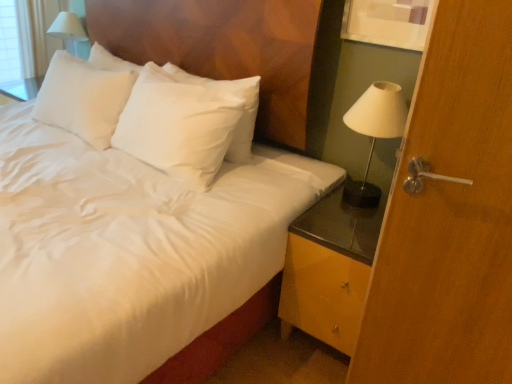
Question: Should I look upward or downward to see white glossy table lamp at upper left?

Choices:
 (A) up
 (B) down

Answer: (A)

Question: Is white glossy table lamp at upper left not within white glossy lamp at right?

Choices:
 (A) no
 (B) yes

Answer: (B)

Question: From the image's perspective, is white glossy table lamp at upper left on white glossy lamp at right?

Choices:
 (A) yes
 (B) no

Answer: (A)

Question: Is white glossy table lamp at upper left facing towards white glossy lamp at right?

Choices:
 (A) no
 (B) yes

Answer: (A)

Question: Can you confirm if white glossy table lamp at upper left is thinner than white glossy lamp at right?

Choices:
 (A) no
 (B) yes

Answer: (B)

Question: Is white glossy table lamp at upper left looking in the opposite direction of white glossy lamp at right?

Choices:
 (A) no
 (B) yes

Answer: (A)

Question: From a real-world perspective, is white glossy table lamp at upper left positioned over white glossy lamp at right based on gravity?

Choices:
 (A) no
 (B) yes

Answer: (B)

Question: Is the position of white satin bed at center more distant than that of white glossy lamp at right?

Choices:
 (A) yes
 (B) no

Answer: (B)

Question: Is white satin bed at center positioned with its back to white glossy lamp at right?

Choices:
 (A) yes
 (B) no

Answer: (B)

Question: From the image's perspective, is white satin bed at center above white glossy lamp at right?

Choices:
 (A) no
 (B) yes

Answer: (A)

Question: Does white satin bed at center contain white glossy lamp at right?

Choices:
 (A) yes
 (B) no

Answer: (B)

Question: Could you tell me if white satin bed at center is facing white glossy lamp at right?

Choices:
 (A) yes
 (B) no

Answer: (B)

Question: Is white satin bed at center touching white glossy lamp at right?

Choices:
 (A) yes
 (B) no

Answer: (B)

Question: Is white satin pillow at upper center at the right side of wooden door handle at right?

Choices:
 (A) no
 (B) yes

Answer: (A)